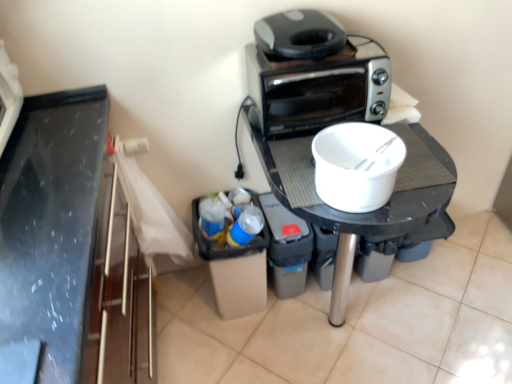
I want to click on free spot below black plastic table at center (from a real-world perspective), so click(342, 329).